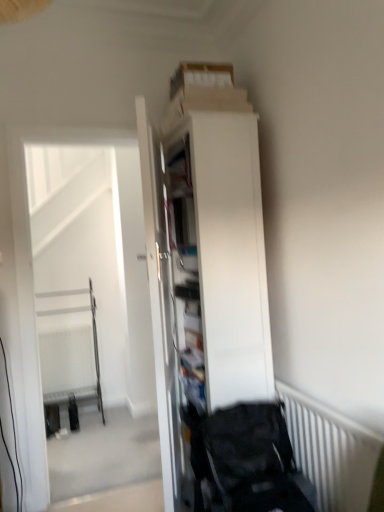
Question: Is white glossy door at center further to camera compared to white striped radiator at lower right?

Choices:
 (A) no
 (B) yes

Answer: (B)

Question: From a real-world perspective, is white glossy door at center positioned under white striped radiator at lower right based on gravity?

Choices:
 (A) no
 (B) yes

Answer: (A)

Question: Considering the relative positions of white glossy door at center and white striped radiator at lower right in the image provided, is white glossy door at center to the right of white striped radiator at lower right from the viewer's perspective?

Choices:
 (A) yes
 (B) no

Answer: (B)

Question: Is white glossy door at center positioned before white striped radiator at lower right?

Choices:
 (A) no
 (B) yes

Answer: (A)

Question: Is white glossy door at center at the left side of white striped radiator at lower right?

Choices:
 (A) yes
 (B) no

Answer: (A)

Question: Can you confirm if white glossy door at center is thinner than white striped radiator at lower right?

Choices:
 (A) yes
 (B) no

Answer: (B)

Question: Is white glossy door at center facing away from black fabric baby carriage at lower right?

Choices:
 (A) yes
 (B) no

Answer: (A)

Question: Is white glossy door at center positioned far away from black fabric baby carriage at lower right?

Choices:
 (A) yes
 (B) no

Answer: (B)

Question: From the image's perspective, is white glossy door at center located above black fabric baby carriage at lower right?

Choices:
 (A) yes
 (B) no

Answer: (A)

Question: Considering the relative positions of white glossy door at center and black fabric baby carriage at lower right in the image provided, is white glossy door at center in front of black fabric baby carriage at lower right?

Choices:
 (A) no
 (B) yes

Answer: (A)

Question: Is white glossy door at center further to the viewer compared to black fabric baby carriage at lower right?

Choices:
 (A) no
 (B) yes

Answer: (B)

Question: Could black fabric baby carriage at lower right be considered to be inside white glossy door at center?

Choices:
 (A) no
 (B) yes

Answer: (A)

Question: Does white glossy door at center have a lesser height compared to white matte cabinet at center?

Choices:
 (A) yes
 (B) no

Answer: (B)